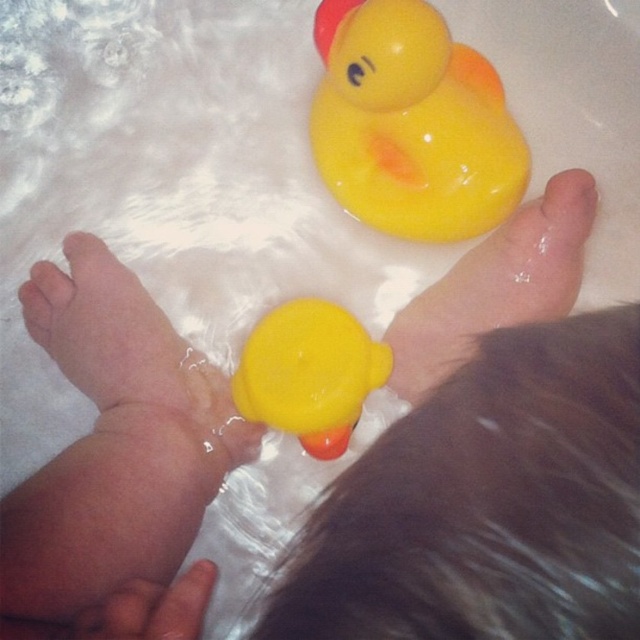
You are a parent trying to locate the rubber duck for your baby. The baby is currently looking at the point marked by coordinates point (x=490, y=460). Which direction should you move the duck to so it faces the baby?

The duck at point (x=490, y=460) is already facing the baby since it is positioned at the coordinates the baby is looking at.

You are a toy collector trying to reach the matte rubber duck at upper center and the matte yellow rubber duck at center in the baby bath. Which duck do you need to reach first to avoid knocking over the other?

You should reach for the matte rubber duck at upper center first because it is closer to you and moving it first will prevent accidentally knocking over the matte yellow rubber duck at center which is further away.

You are a curious baby looking at the two ducks in your bath. Which duck is nearer to you, the matte rubber duck at upper center or the matte yellow rubber duck at lower center?

The matte rubber duck at upper center is closer to you than the matte yellow rubber duck at lower center.